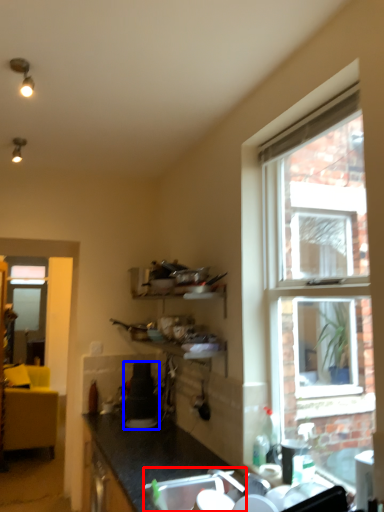
Question: Among these objects, which one is nearest to the camera, sink (highlighted by a red box) or appliance (highlighted by a blue box)?

Choices:
 (A) sink
 (B) appliance

Answer: (A)